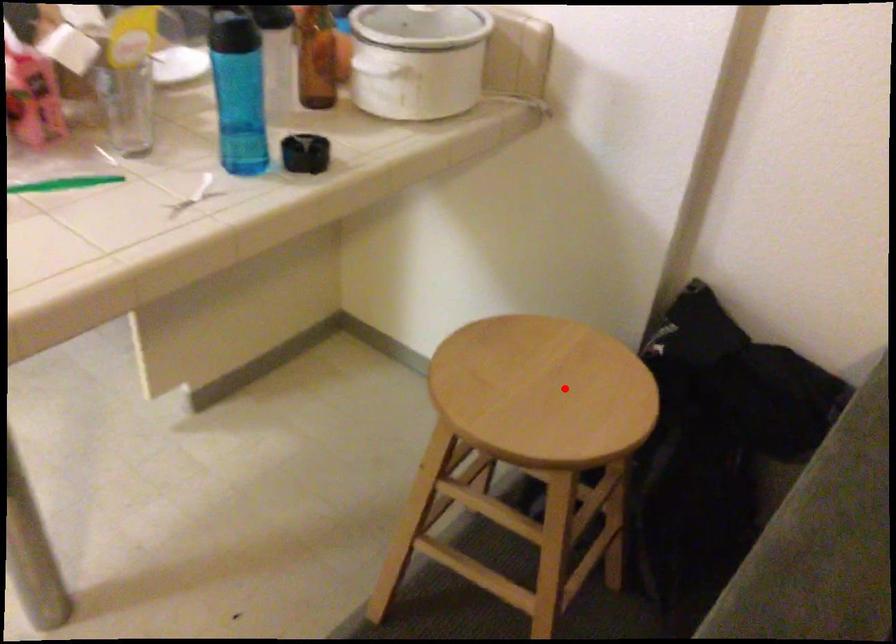
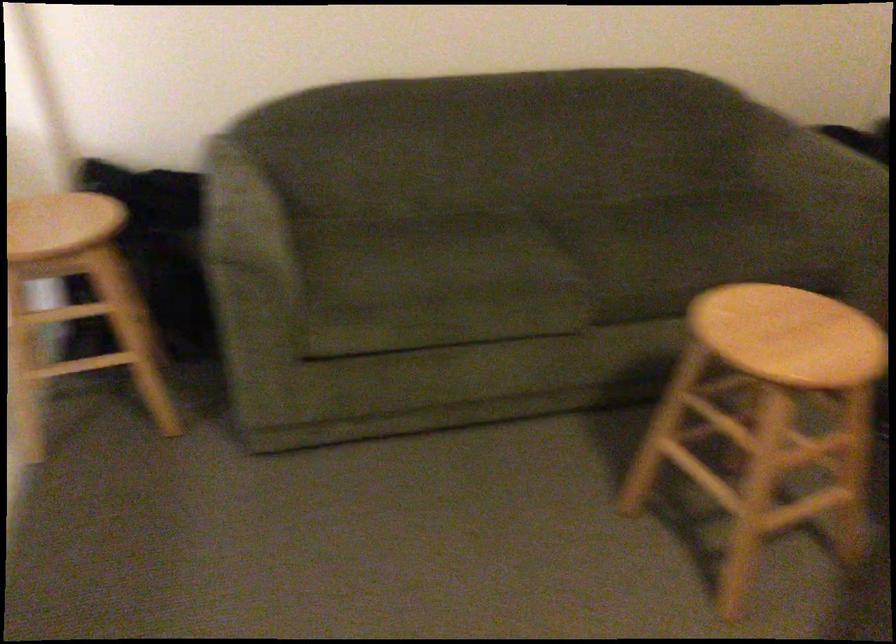
Question: I am providing you with two images of the same scene from different viewpoints. In image1, a red point is highlighted. Considering the same 3D point in image2, which of the following is correct?

Choices:
 (A) It is closer
 (B) It is farther

Answer: (B)